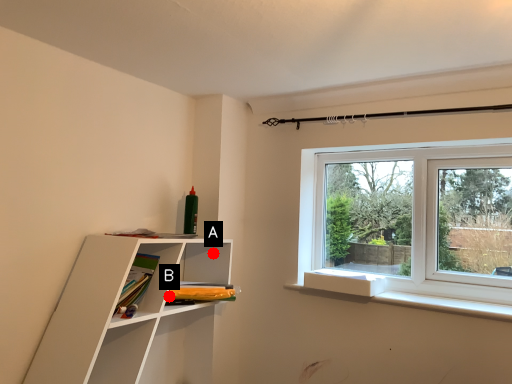
Question: Two points are circled on the image, labeled by A and B beside each circle. Which of the following is the closest to the observer?

Choices:
 (A) A is closer
 (B) B is closer

Answer: (B)